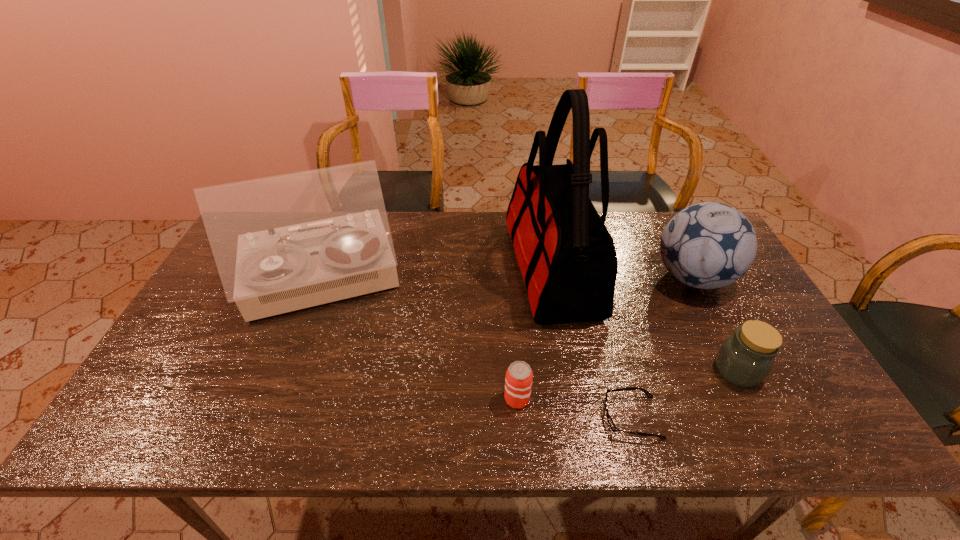
I want to click on free space between the spectacles and the duffel bag, so click(x=592, y=343).

Identify the location of empty location between the beer can and the soccer ball. The height and width of the screenshot is (540, 960). (605, 338).

The height and width of the screenshot is (540, 960). Find the location of `vacant point located between the fourth shortest object and the beer can`. vacant point located between the fourth shortest object and the beer can is located at coordinates (605, 338).

Where is `free space between the shortest object and the record player`? Image resolution: width=960 pixels, height=540 pixels. free space between the shortest object and the record player is located at coordinates (477, 348).

This screenshot has width=960, height=540. In order to click on vacant area that lies between the leftmost object and the fifth tallest object in this screenshot , I will do `click(420, 339)`.

Find the location of a particular element. Image resolution: width=960 pixels, height=540 pixels. vacant space that is in between the soccer ball and the record player is located at coordinates (508, 278).

This screenshot has width=960, height=540. What are the coordinates of `vacant area that lies between the shortest object and the fifth tallest object` in the screenshot? It's located at (574, 408).

Find the location of a particular element. The height and width of the screenshot is (540, 960). vacant area between the soccer ball and the shortest object is located at coordinates (662, 348).

Locate an element on the screen. free area in between the beer can and the shortest object is located at coordinates (574, 408).

Identify the location of empty space that is in between the second tallest object and the second shortest object. The height and width of the screenshot is (540, 960). (420, 339).